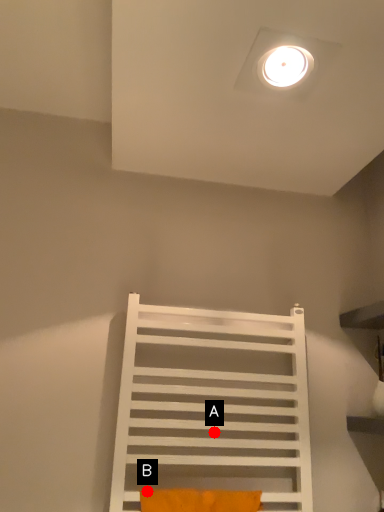
Question: Two points are circled on the image, labeled by A and B beside each circle. Which point is farther to the camera?

Choices:
 (A) A is further
 (B) B is further

Answer: (A)